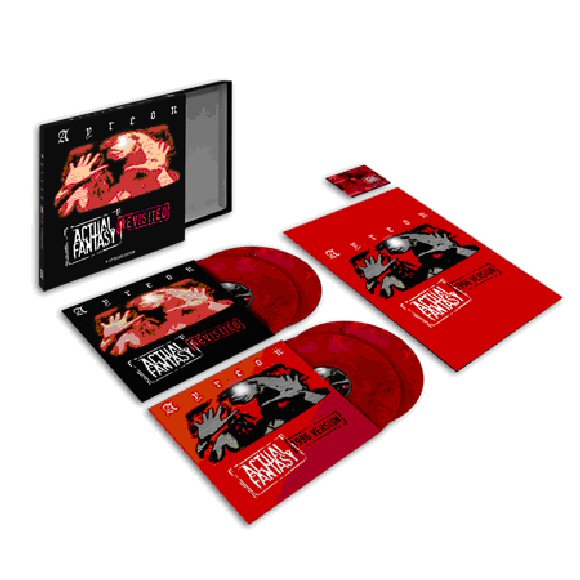
Find the location of a particular element. space between dvd sleeves is located at coordinates (228, 365).